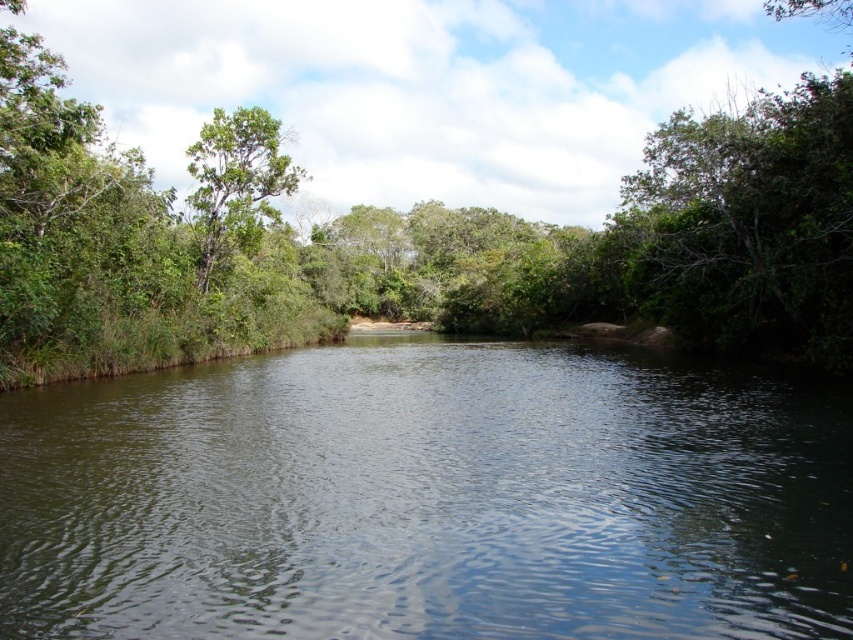
Question: Is green leafy tree at center smaller than green leafy tree at upper left?

Choices:
 (A) no
 (B) yes

Answer: (A)

Question: Which point is closer to the camera?

Choices:
 (A) (252, 170)
 (B) (154, 416)
 (C) (817, 90)

Answer: (B)

Question: Does green leafy tree at center appear on the left side of green leafy tree at upper left?

Choices:
 (A) yes
 (B) no

Answer: (B)

Question: Based on their relative distances, which object is nearer to the green leafy tree at upper left?

Choices:
 (A) green leafy tree at center
 (B) dark green water at center

Answer: (B)

Question: Which is farther from the dark green water at center?

Choices:
 (A) green leafy tree at upper left
 (B) green leafy tree at center

Answer: (B)

Question: Is green leafy tree at center closer to camera compared to green leafy tree at upper left?

Choices:
 (A) no
 (B) yes

Answer: (B)